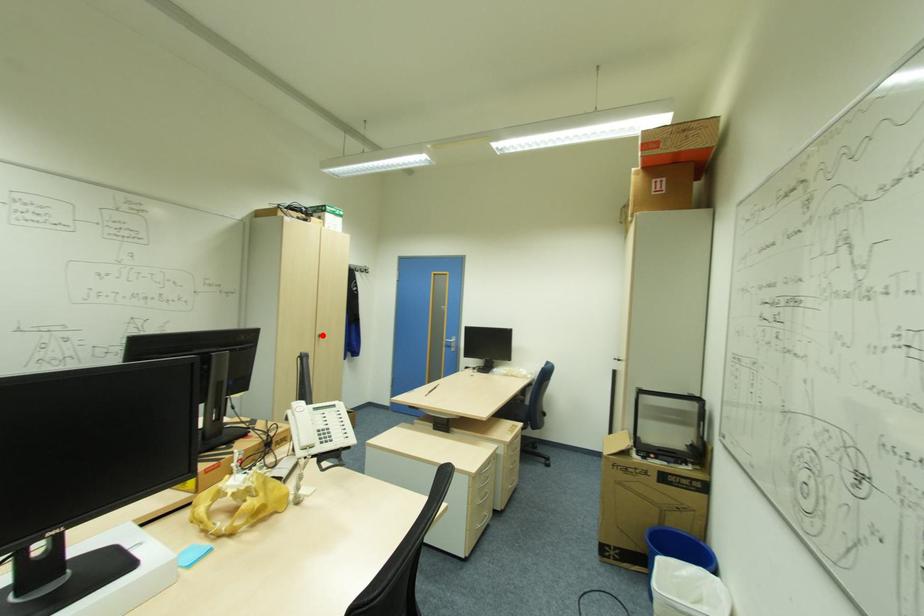
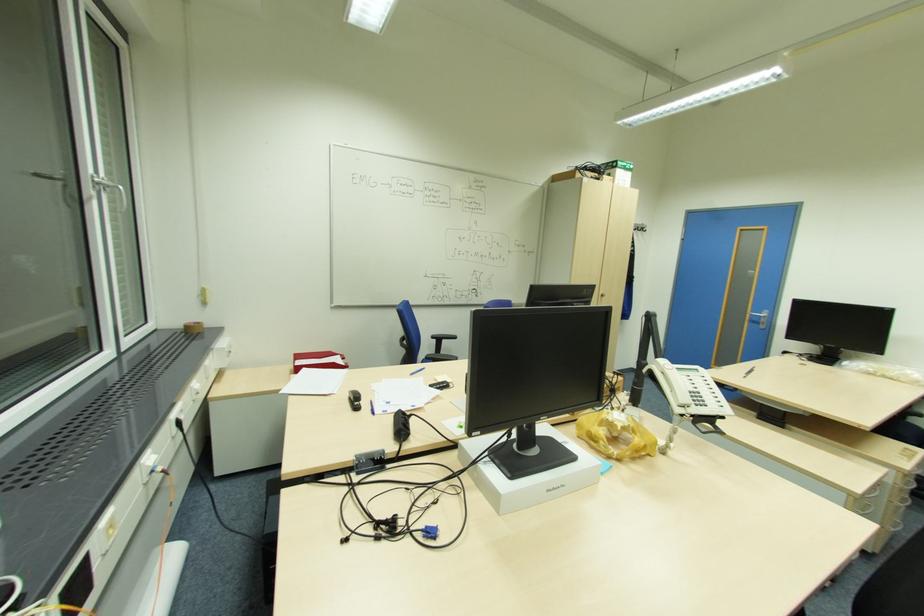
Question: A red point is marked in image1. In image2, is the corresponding 3D point closer to the camera or farther? Reply with the corresponding letter.

Choices:
 (A) The corresponding 3D point is closer.
 (B) The corresponding 3D point is farther.

Answer: (B)